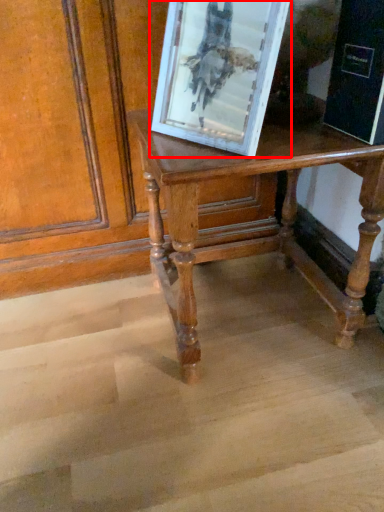
Question: From the image's perspective, considering the relative positions of picture frame (annotated by the red box) and table in the image provided, where is picture frame (annotated by the red box) located with respect to the staircase?

Choices:
 (A) above
 (B) below

Answer: (A)